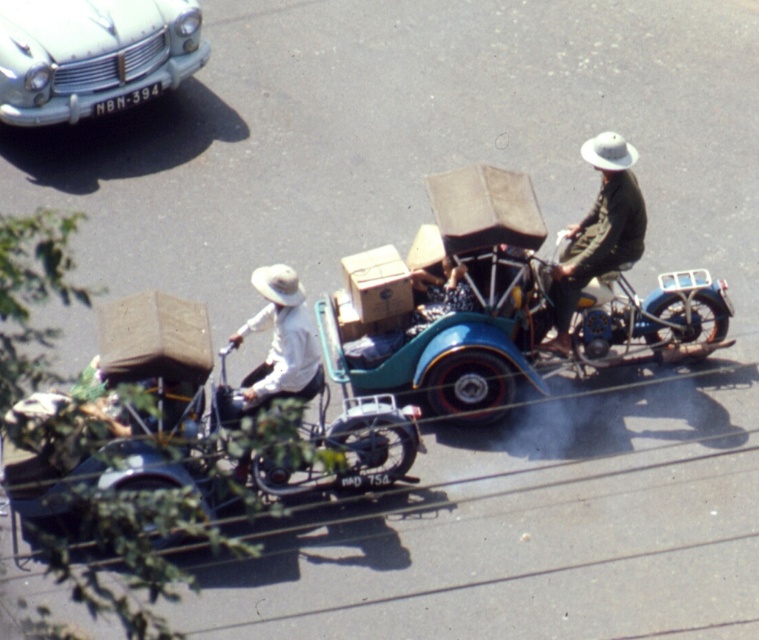
Is light blue metallic car at upper left smaller than white matte hat at center?

Actually, light blue metallic car at upper left might be larger than white matte hat at center.

Can you confirm if light blue metallic car at upper left is positioned to the left of white matte hat at center?

Correct, you'll find light blue metallic car at upper left to the left of white matte hat at center.

Who is more distant from viewer, (65, 68) or (282, 369)?

The point (65, 68) is more distant.

Find the location of a particular element. The image size is (759, 640). light blue metallic car at upper left is located at coordinates (93, 54).

Is light blue metallic car at upper left smaller than green fabric hat at upper right?

No, light blue metallic car at upper left is not smaller than green fabric hat at upper right.

In the scene shown: Can you confirm if light blue metallic car at upper left is shorter than green fabric hat at upper right?

Yes, light blue metallic car at upper left is shorter than green fabric hat at upper right.

Who is more forward, (x=90, y=104) or (x=565, y=289)?

Positioned in front is point (x=565, y=289).

Locate an element on the screen. light blue metallic car at upper left is located at coordinates (93, 54).

Can you confirm if green fabric hat at upper right is positioned to the left of white matte hat at center?

Incorrect, green fabric hat at upper right is not on the left side of white matte hat at center.

I want to click on green fabric hat at upper right, so click(597, 230).

Find the location of a particular element. The height and width of the screenshot is (640, 759). green fabric hat at upper right is located at coordinates (597, 230).

The height and width of the screenshot is (640, 759). I want to click on green fabric hat at upper right, so click(x=597, y=230).